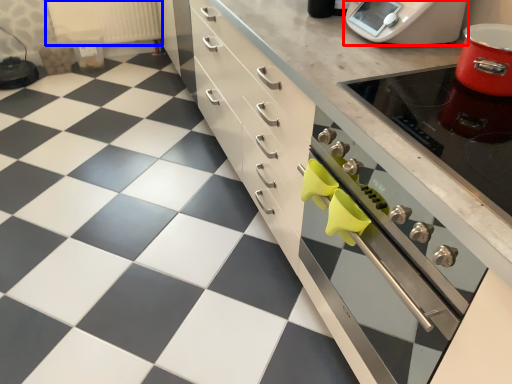
Question: Which object is closer to the camera taking this photo, home appliance (highlighted by a red box) or radiator (highlighted by a blue box)?

Choices:
 (A) home appliance
 (B) radiator

Answer: (A)